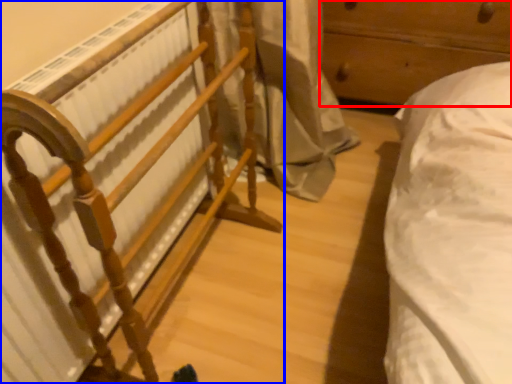
Question: Which point is further to the camera, furniture (highlighted by a red box) or furniture (highlighted by a blue box)?

Choices:
 (A) furniture
 (B) furniture

Answer: (A)